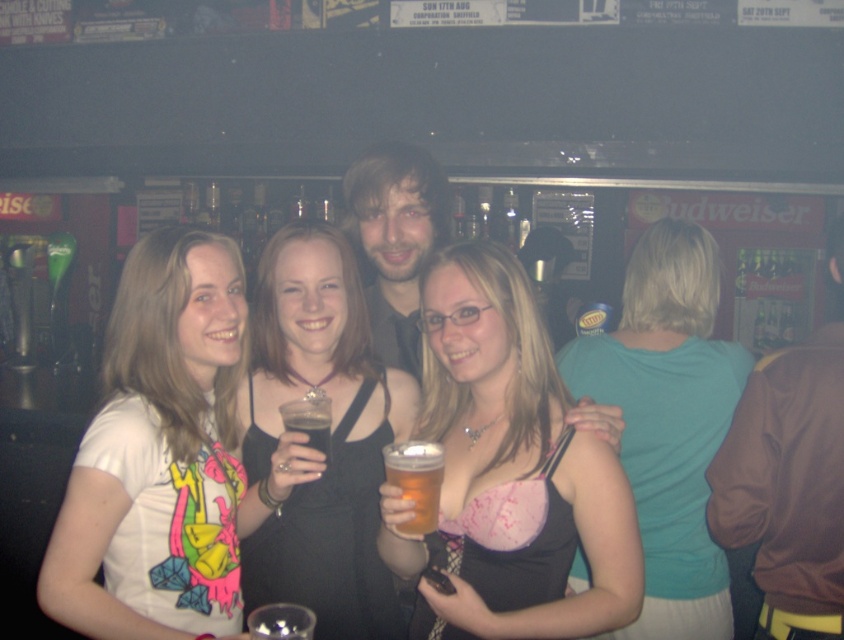
Question: Can you confirm if white matte t-shirt at left is positioned below translucent glass beer at center?

Choices:
 (A) yes
 (B) no

Answer: (B)

Question: Which point is closer to the camera taking this photo?

Choices:
 (A) (419, 467)
 (B) (484, 618)

Answer: (A)

Question: Can you confirm if translucent plastic cup at center is positioned to the right of translucent glass beer at center?

Choices:
 (A) no
 (B) yes

Answer: (B)

Question: Observing the image, what is the correct spatial positioning of pink satin dress at center in reference to teal fabric shirt at upper right?

Choices:
 (A) below
 (B) above

Answer: (B)

Question: Among these points, which one is farthest from the camera?

Choices:
 (A) (474, 513)
 (B) (326, 419)
 (C) (201, 499)
 (D) (334, 296)

Answer: (D)

Question: Which point is farther to the camera?

Choices:
 (A) (705, 449)
 (B) (771, 612)
 (C) (391, 307)

Answer: (C)